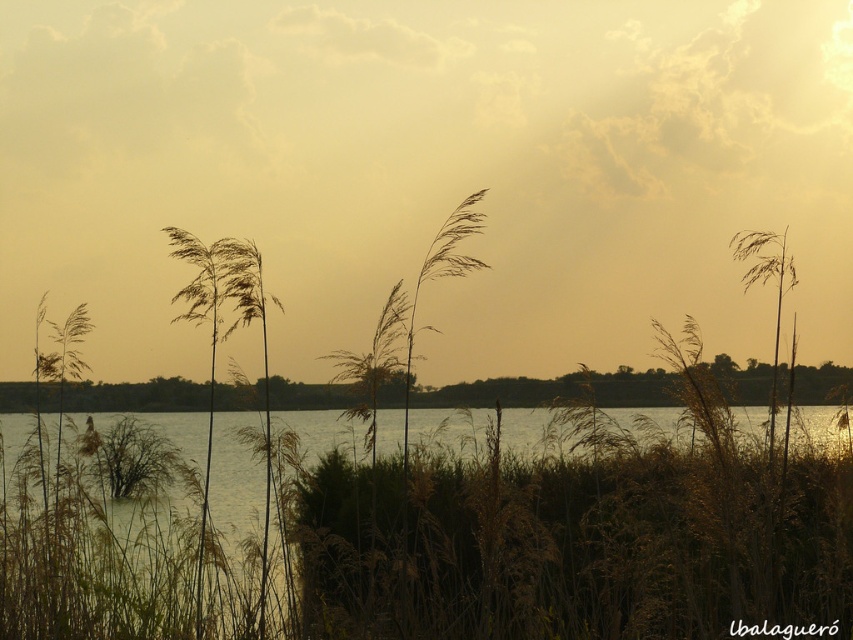
Who is taller, sandy yellow cloud at upper center or brown dry grass at center?

sandy yellow cloud at upper center

Can you confirm if sandy yellow cloud at upper center is shorter than brown dry grass at center?

No, sandy yellow cloud at upper center is not shorter than brown dry grass at center.

The image size is (853, 640). What are the coordinates of `sandy yellow cloud at upper center` in the screenshot? It's located at (427, 170).

Locate an element on the screen. The image size is (853, 640). sandy yellow cloud at upper center is located at coordinates (427, 170).